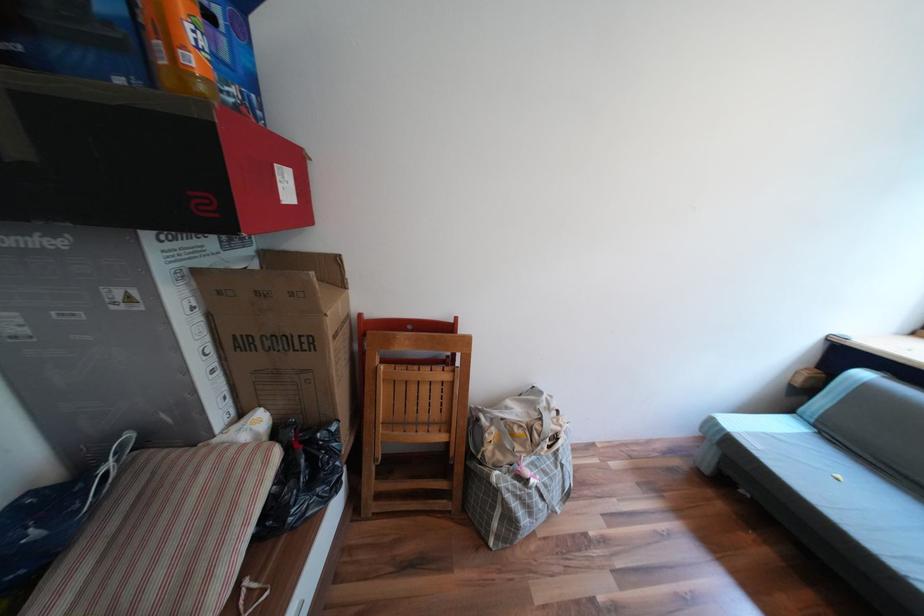
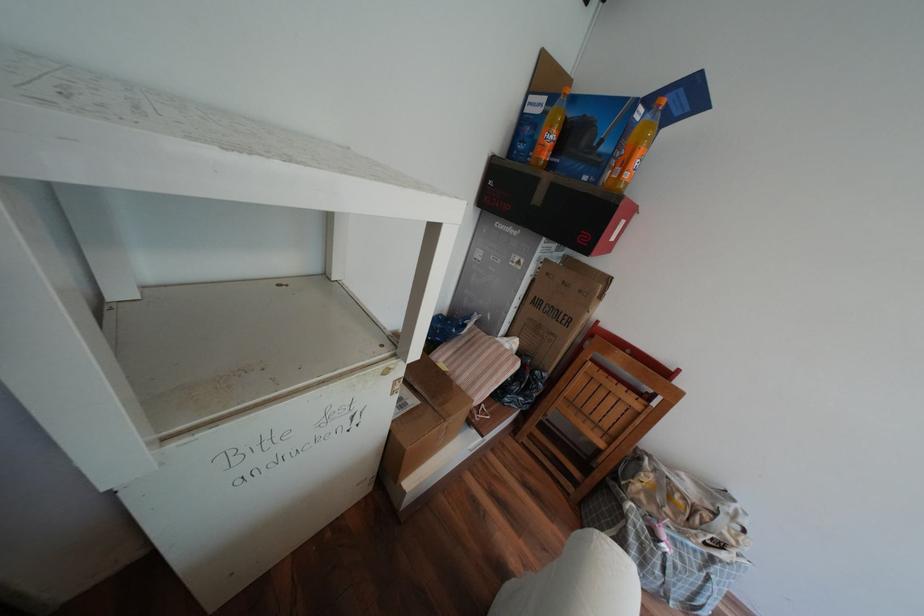
Find the pixel in the second image that matches point 258,464 in the first image.

(517, 360)